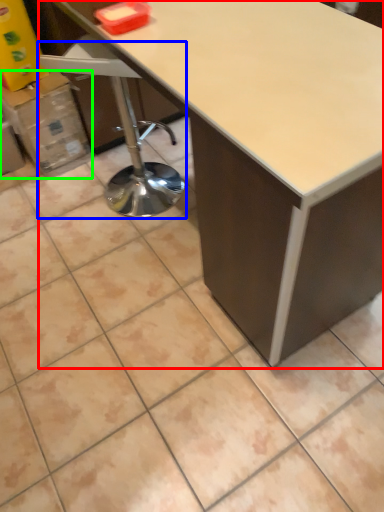
Question: Based on their relative distances, which object is farther from table (highlighted by a red box)? Choose from swivel chair (highlighted by a blue box) and cardboard box (highlighted by a green box).

Choices:
 (A) swivel chair
 (B) cardboard box

Answer: (B)